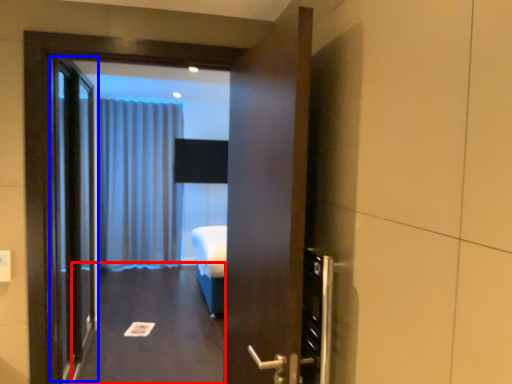
Question: Which point is closer to the camera, corridor (highlighted by a red box) or elevator door (highlighted by a blue box)?

Choices:
 (A) corridor
 (B) elevator door

Answer: (B)